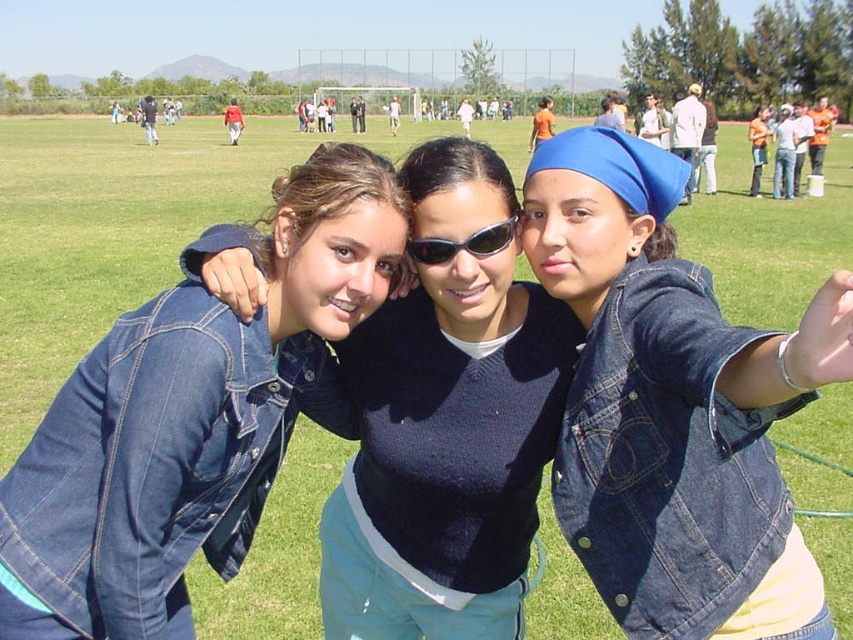
Is point (322, 195) closer to viewer compared to point (502, 250)?

That is True.

Looking at this image, who is more distant from viewer, [15,547] or [421,248]?

Point [421,248]

Find the location of a particular element. denim jacket at left is located at coordinates (189, 419).

Is blue denim jacket at center further to camera compared to denim jacket at center?

That is False.

Between point (575, 378) and point (433, 385), which one is positioned in front?

Positioned in front is point (575, 378).

Identify the location of blue denim jacket at center. This screenshot has width=853, height=640. (672, 406).

The width and height of the screenshot is (853, 640). What do you see at coordinates (445, 424) in the screenshot?
I see `denim jacket at center` at bounding box center [445, 424].

Who is positioned more to the left, denim jacket at center or black plastic goggles at center?

denim jacket at center

The image size is (853, 640). Identify the location of denim jacket at center. (445, 424).